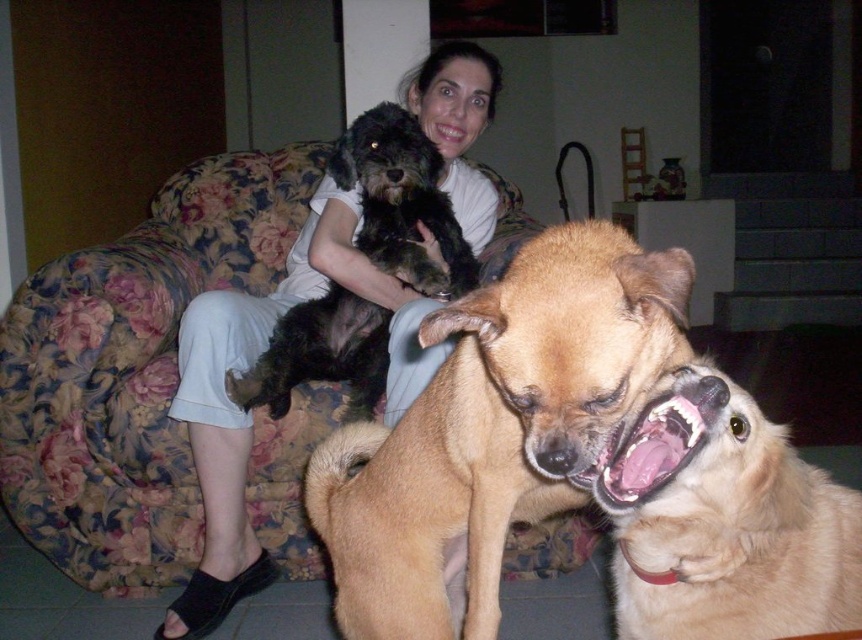
You are standing in the same room as the woman and her dogs. You want to place a small decorative item exactly at the point marked by the coordinates point [679,412]. If you are 5 feet tall, will you be able to see the item without bending down?

The point [679,412] is 31.66 inches away from the viewer. Since 31.66 inches is approximately 2.64 feet, and you are 5 feet tall, you can see the item without bending down as it is within your line of sight.

You are trying to decide which item is taller between the light brown fur dog at center and the white cotton shirt at upper center. Based on the scene, which one is taller?

The light brown fur dog at center is not as tall as the white cotton shirt at upper center, so the white cotton shirt at upper center is taller.